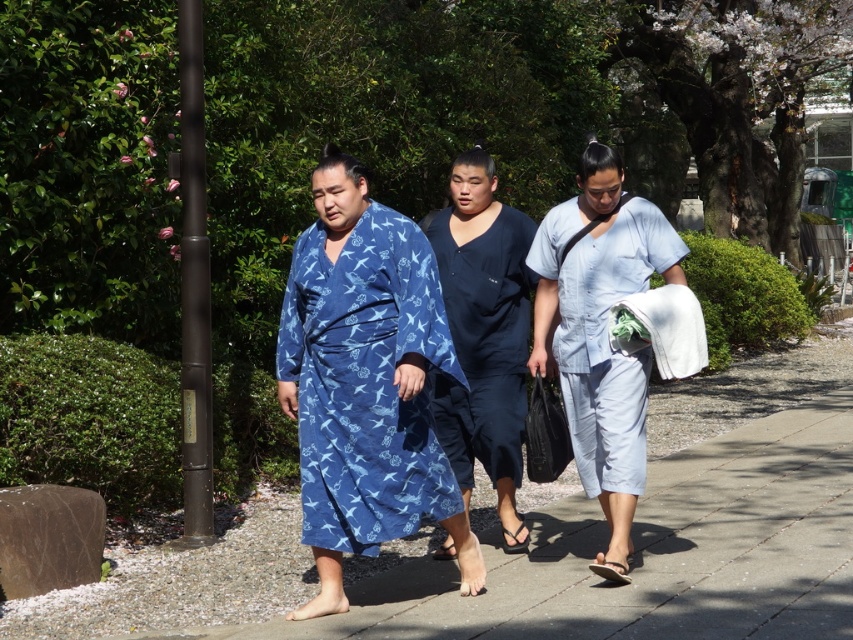
Question: Which object is farther from the camera taking this photo?

Choices:
 (A) blue printed robe at center
 (B) light blue fabric at center

Answer: (B)

Question: Which point appears closest to the camera in this image?

Choices:
 (A) (570, 360)
 (B) (473, 422)
 (C) (381, 406)

Answer: (C)

Question: From the image, what is the correct spatial relationship of blue printed robe at center in relation to light blue fabric at center?

Choices:
 (A) above
 (B) below

Answer: (B)

Question: Where is blue printed robe at center located in relation to light blue fabric at center in the image?

Choices:
 (A) below
 (B) above

Answer: (A)

Question: Is blue printed robe at center thinner than light blue fabric at center?

Choices:
 (A) no
 (B) yes

Answer: (A)

Question: Which point is farther to the camera?

Choices:
 (A) blue printed robe at center
 (B) dark blue fabric at center

Answer: (B)